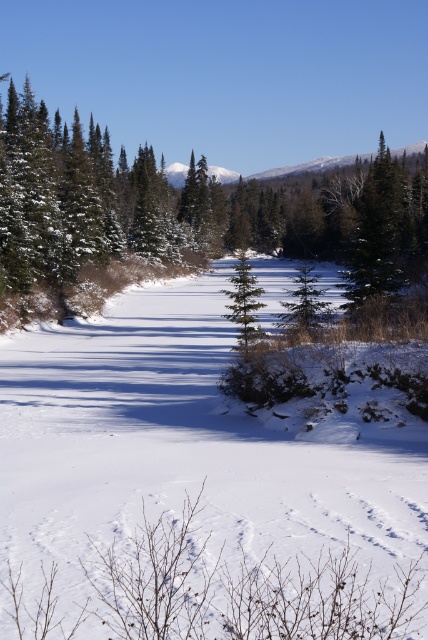
Question: Is white fluffy snow at center to the left of green matte evergreen tree at center from the viewer's perspective?

Choices:
 (A) no
 (B) yes

Answer: (B)

Question: Which is nearer to the green matte tree at center?

Choices:
 (A) white fluffy snow at center
 (B) green matte evergreen tree at center

Answer: (A)

Question: Can you confirm if green matte evergreen tree at center is positioned above green matte tree at center?

Choices:
 (A) yes
 (B) no

Answer: (A)

Question: Which object is farther from the camera taking this photo?

Choices:
 (A) white fluffy snow at center
 (B) green matte tree at center

Answer: (B)

Question: Which point is farther to the camera?

Choices:
 (A) (95, 403)
 (B) (238, 285)
 (C) (247, 241)

Answer: (C)

Question: Is green matte evergreen tree at center below green matte tree at center?

Choices:
 (A) yes
 (B) no

Answer: (B)